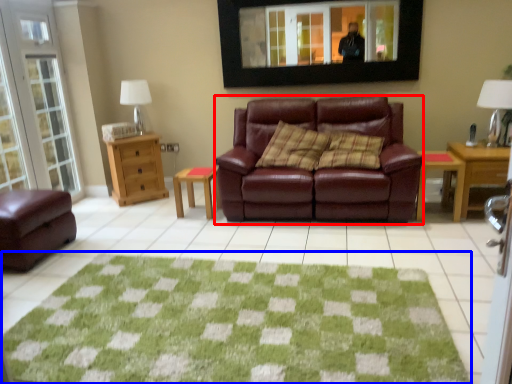
Question: Among these objects, which one is farthest to the camera, studio couch (highlighted by a red box) or doormat (highlighted by a blue box)?

Choices:
 (A) studio couch
 (B) doormat

Answer: (A)